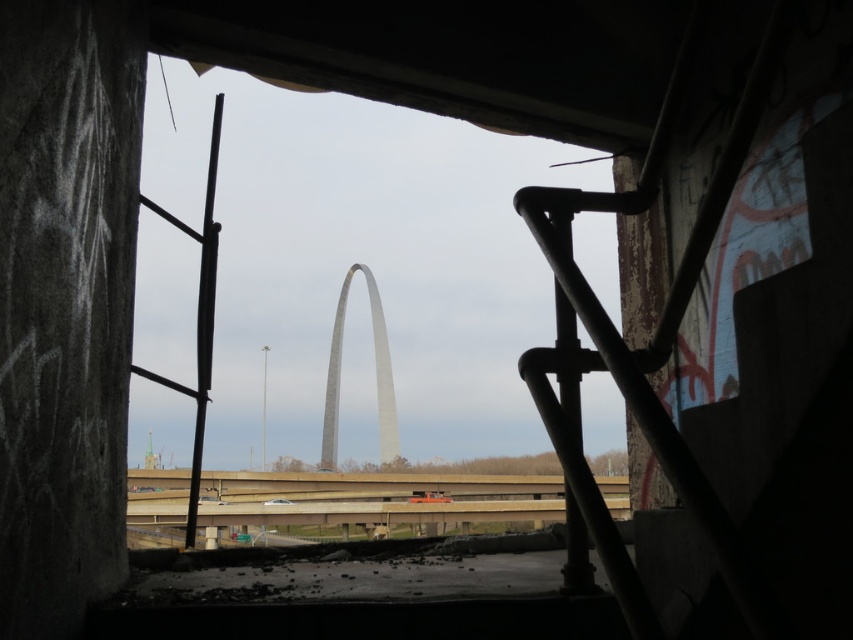
Is rusty metal ladder at left below gray metallic arch at center?

Actually, rusty metal ladder at left is above gray metallic arch at center.

Can you confirm if rusty metal ladder at left is taller than gray metallic arch at center?

Yes.

Describe the element at coordinates (196, 316) in the screenshot. I see `rusty metal ladder at left` at that location.

At what (x,y) coordinates should I click in order to perform the action: click on rusty metal ladder at left. Please return your answer as a coordinate pair (x, y). This screenshot has height=640, width=853. Looking at the image, I should click on (196, 316).